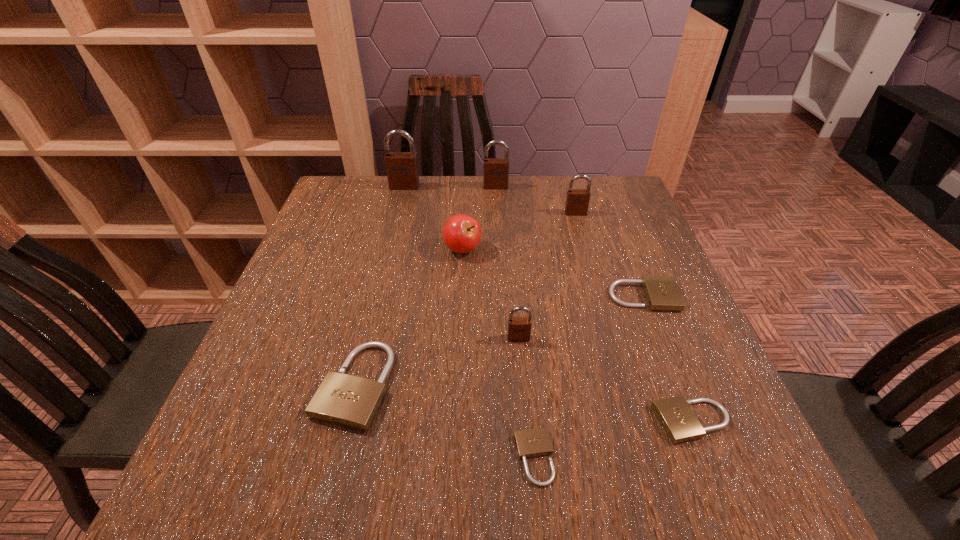
In the image, there is a desktop. Where is `free space at the far edge`? This screenshot has width=960, height=540. free space at the far edge is located at coordinates (475, 200).

You are a GUI agent. You are given a task and a screenshot of the screen. Output one action in this format:
    pyautogui.click(x=<x>, y=<y>)
    Task: Click on the vacant space at the left edge of the desktop
    
    Given the screenshot: What is the action you would take?
    pyautogui.click(x=235, y=415)

Find the location of a particular element. The width and height of the screenshot is (960, 540). free space at the right edge of the desktop is located at coordinates (603, 227).

Where is `vacant space at the far left corner of the desktop`? vacant space at the far left corner of the desktop is located at coordinates (358, 211).

Locate an element on the screen. The width and height of the screenshot is (960, 540). vacant space at the far right corner is located at coordinates (613, 204).

Locate an element on the screen. The width and height of the screenshot is (960, 540). vacant position at the near right corner of the desktop is located at coordinates tap(716, 498).

Identify the location of free space between the second tallest object and the second shortest padlock. The width and height of the screenshot is (960, 540). pyautogui.click(x=594, y=304).

At what (x,y) coordinates should I click in order to perform the action: click on vacant region between the seventh shortest padlock and the red apple. Please return your answer as a coordinate pair (x, y). The image size is (960, 540). Looking at the image, I should click on (479, 218).

At what (x,y) coordinates should I click in order to perform the action: click on vacant space in between the biggest beige padlock and the smallest beige padlock. Please return your answer as a coordinate pair (x, y). This screenshot has height=540, width=960. Looking at the image, I should click on (444, 422).

Where is `blank region between the leftmost brown padlock and the leftmost beige padlock`? blank region between the leftmost brown padlock and the leftmost beige padlock is located at coordinates (379, 286).